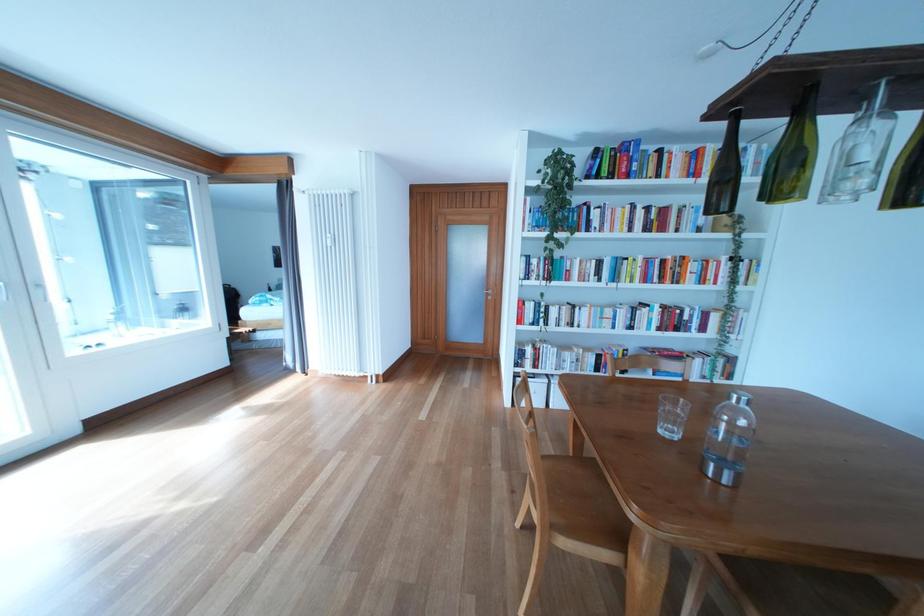
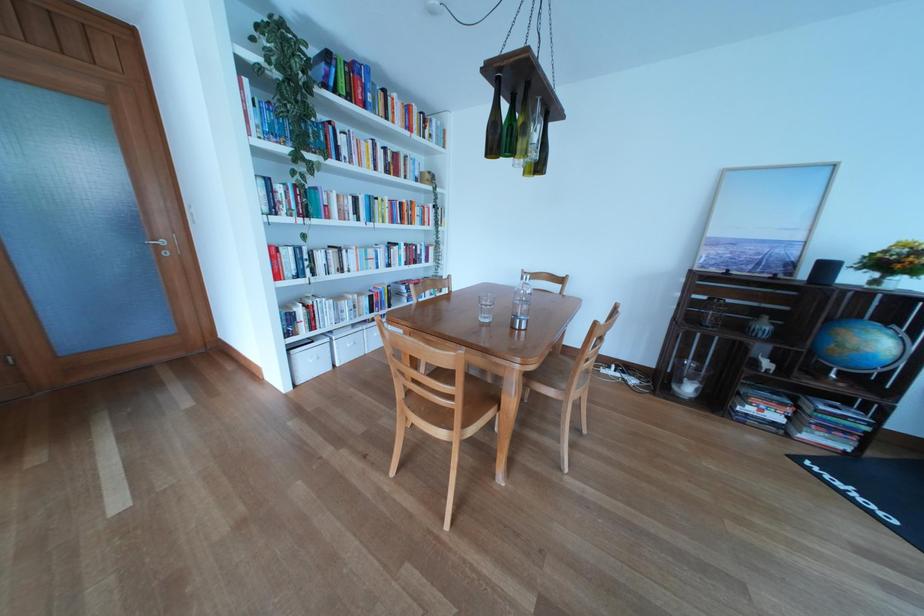
In the second image, find the point that corresponds to the point at 613,268 in the first image.

(369, 206)